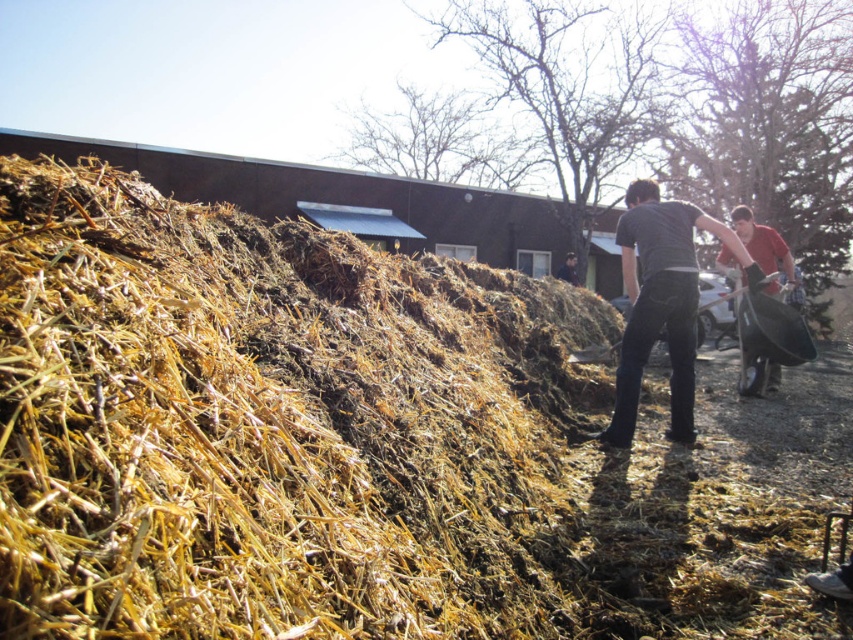
Based on the photo, is the position of dark gray shirt at center more distant than that of matte black shovel at right?

No, dark gray shirt at center is closer to the viewer.

Is dark gray shirt at center shorter than matte black shovel at right?

Indeed, dark gray shirt at center has a lesser height compared to matte black shovel at right.

Locate an element on the screen. dark gray shirt at center is located at coordinates (662, 301).

Is brown straw at center to the left of matte black shovel at right from the viewer's perspective?

Correct, you'll find brown straw at center to the left of matte black shovel at right.

Describe the element at coordinates (274, 426) in the screenshot. I see `brown straw at center` at that location.

At what (x,y) coordinates should I click in order to perform the action: click on brown straw at center. Please return your answer as a coordinate pair (x, y). The width and height of the screenshot is (853, 640). Looking at the image, I should click on (274, 426).

Between brown straw at center and dark gray shirt at center, which one is positioned lower?

brown straw at center is lower down.

Measure the distance from brown straw at center to dark gray shirt at center.

brown straw at center is 12.31 feet from dark gray shirt at center.

Is point (112, 368) positioned before point (659, 330)?

Yes, it is.

The width and height of the screenshot is (853, 640). In order to click on brown straw at center in this screenshot , I will do `click(274, 426)`.